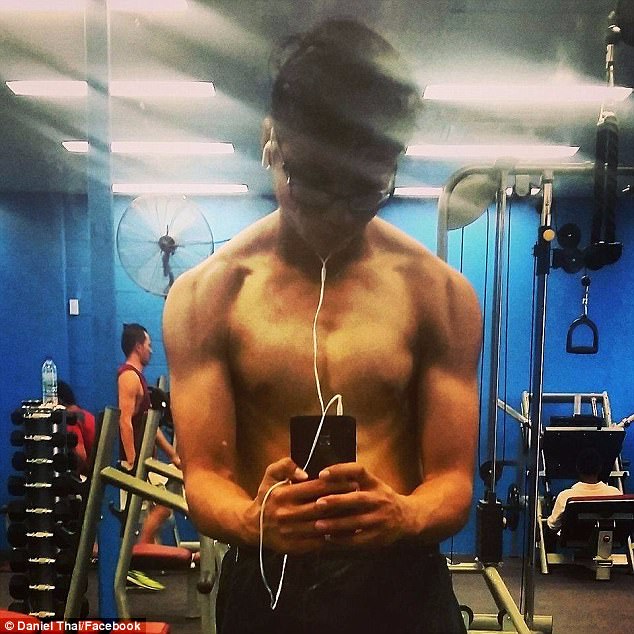
Find the location of a particular element. This screenshot has width=634, height=634. white headphone wire is located at coordinates (340, 403), (313, 320).